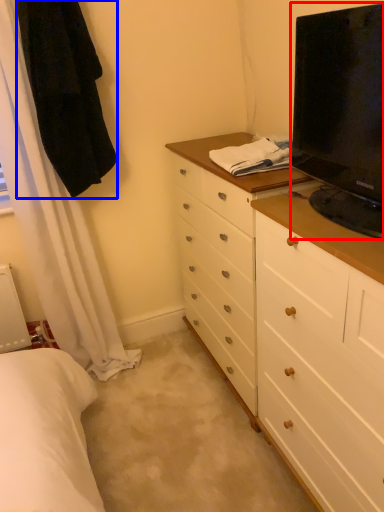
Question: Which of the following is the farthest to the observer, television (highlighted by a red box) or robe (highlighted by a blue box)?

Choices:
 (A) television
 (B) robe

Answer: (B)